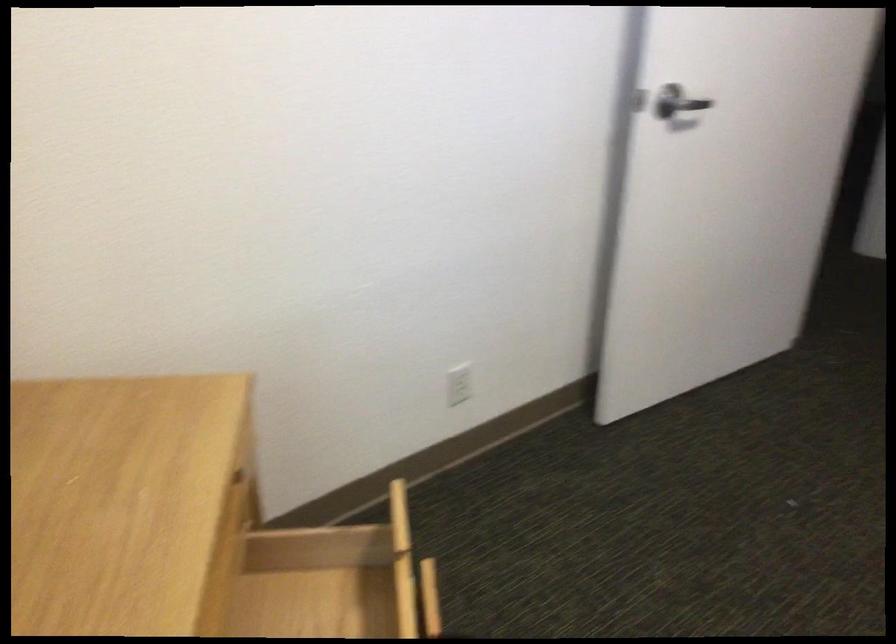
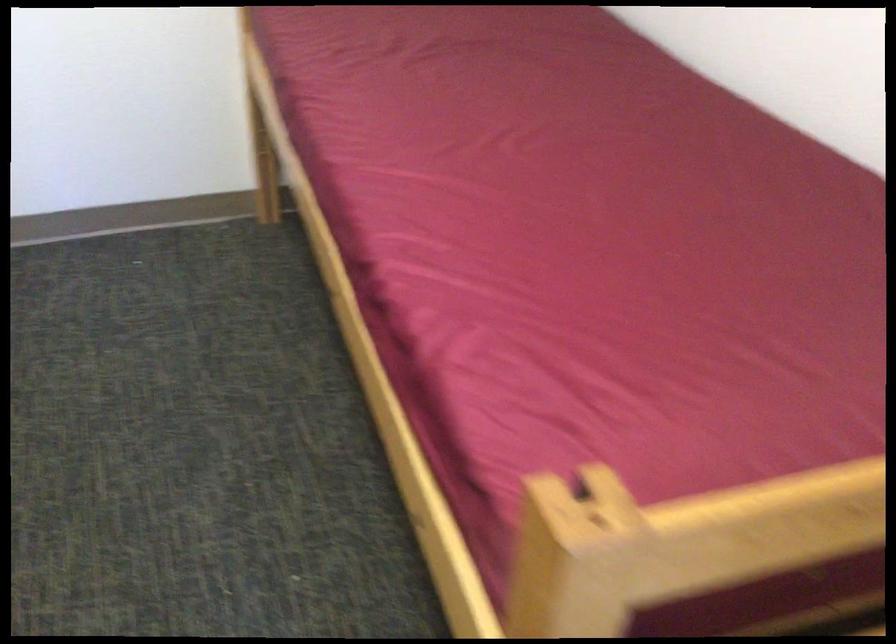
How did the camera likely rotate?

The camera's rotation is toward right-down.